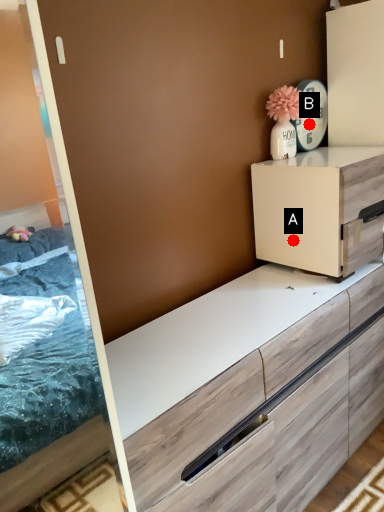
Question: Two points are circled on the image, labeled by A and B beside each circle. Which point is closer to the camera?

Choices:
 (A) A is closer
 (B) B is closer

Answer: (A)